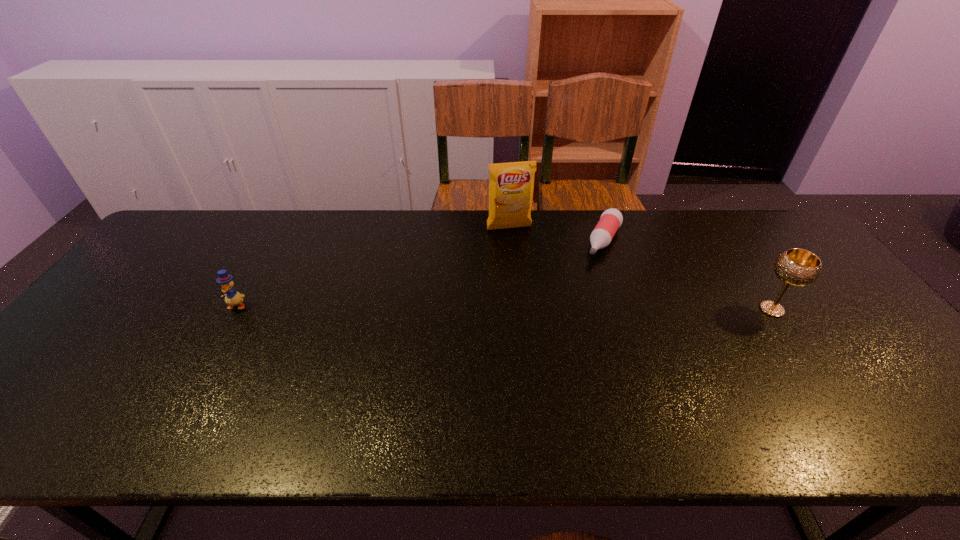
Find the location of a particular element. free space located on the front of the second object from left to right with the logo is located at coordinates (538, 300).

This screenshot has width=960, height=540. What are the coordinates of `vacant space located 0.100m on the front of the second object from left to right with the logo` in the screenshot? It's located at (520, 253).

I want to click on vacant area situated 0.400m on the front of the second object from left to right with the logo, so click(x=546, y=325).

Locate an element on the screen. Image resolution: width=960 pixels, height=540 pixels. free space located 0.050m with the cap open on the bottle is located at coordinates (594, 269).

You are a GUI agent. You are given a task and a screenshot of the screen. Output one action in this format:
    pyautogui.click(x=<x>, y=<y>)
    Task: Click on the vacant space located with the cap open on the bottle
    
    Given the screenshot: What is the action you would take?
    pyautogui.click(x=556, y=337)

Where is `vacant space located with the cap open on the bottle`? This screenshot has height=540, width=960. vacant space located with the cap open on the bottle is located at coordinates coord(579,296).

Where is `crisp (potato chip) that is positioned at the far edge`? This screenshot has width=960, height=540. crisp (potato chip) that is positioned at the far edge is located at coordinates (511, 185).

The image size is (960, 540). I want to click on bottle present at the far edge, so click(611, 219).

At what (x,y) coordinates should I click in order to perform the action: click on vacant space at the far edge of the desktop. Please return your answer as a coordinate pair (x, y). Looking at the image, I should click on (626, 210).

Locate an element on the screen. This screenshot has width=960, height=540. vacant space at the near edge is located at coordinates (660, 404).